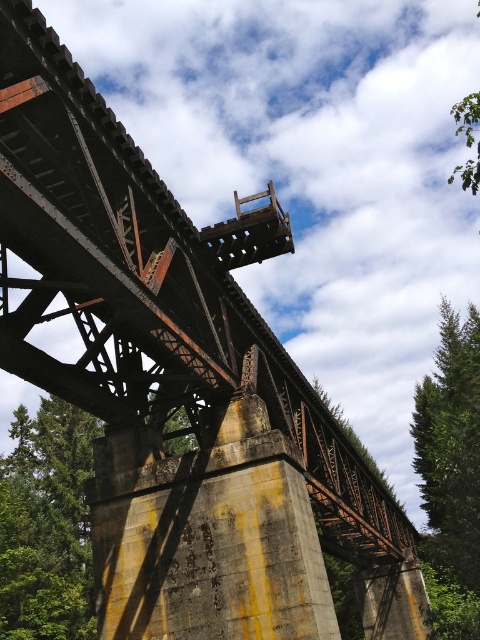
You are standing under the railway trestle bridge and notice two trees. One is the green leafy tree at lower left and the other is the green textured tree at right. Which tree is closer to you?

The green leafy tree at lower left is closer to you because it is further to the viewer than the green textured tree at right.

You are standing under the railway bridge and see the green leafy tree at lower left and the green textured tree at right. Which tree is positioned more to the east if the bridge runs north to south?

The green leafy tree at lower left is positioned more to the east because it is to the left of the green textured tree at right, and since the bridge runs north to south, left would correspond to the eastern direction.

You are standing under the railway trestle bridge and notice two trees. One is the green leafy tree at lower left and the other is the green textured tree at right. Which tree is shorter?

The green leafy tree at lower left is shorter than the green textured tree at right.